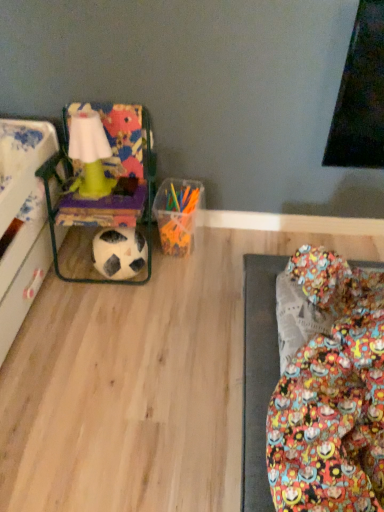
What do you see at coordinates (107, 183) in the screenshot?
I see `multicolored fabric bean bag chair at left` at bounding box center [107, 183].

The image size is (384, 512). I want to click on multicolored fabric bean bag chair at left, so click(107, 183).

Image resolution: width=384 pixels, height=512 pixels. What do you see at coordinates (119, 253) in the screenshot?
I see `black matte football at lower left` at bounding box center [119, 253].

Image resolution: width=384 pixels, height=512 pixels. Identify the location of black matte football at lower left. (119, 253).

Measure the distance between point (127, 234) and camera.

The depth of point (127, 234) is 1.53 meters.

What are the coordinates of `multicolored fabric bean bag chair at left` in the screenshot? It's located at coord(107,183).

Between multicolored fabric bean bag chair at left and black matte football at lower left, which one appears on the left side from the viewer's perspective?

multicolored fabric bean bag chair at left.

Is multicolored fabric bean bag chair at left further to the viewer compared to black matte football at lower left?

That is False.

Does point (66, 223) come in front of point (137, 240)?

Yes.

From the image's perspective, which is above, multicolored fabric bean bag chair at left or black matte football at lower left?

multicolored fabric bean bag chair at left, from the image's perspective.

From a real-world perspective, is multicolored fabric bean bag chair at left below black matte football at lower left?

No, from a real-world perspective, multicolored fabric bean bag chair at left is not below black matte football at lower left.

Based on the photo, considering the sizes of multicolored fabric bean bag chair at left and black matte football at lower left in the image, is multicolored fabric bean bag chair at left wider or thinner than black matte football at lower left?

In the image, multicolored fabric bean bag chair at left appears to be wider than black matte football at lower left.

Consider the image. Does multicolored fabric bean bag chair at left have a greater height compared to black matte football at lower left?

Yes.

Who is bigger, multicolored fabric bean bag chair at left or black matte football at lower left?

multicolored fabric bean bag chair at left is bigger.

Which is correct: multicolored fabric bean bag chair at left is inside black matte football at lower left, or outside of it?

multicolored fabric bean bag chair at left is outside black matte football at lower left.

Is multicolored fabric bean bag chair at left in contact with black matte football at lower left?

multicolored fabric bean bag chair at left is not next to black matte football at lower left, and they're not touching.

Is multicolored fabric bean bag chair at left turned away from black matte football at lower left?

No, multicolored fabric bean bag chair at left's orientation is not away from black matte football at lower left.

How different are the orientations of multicolored fabric bean bag chair at left and black matte football at lower left in degrees?

The angular difference between multicolored fabric bean bag chair at left and black matte football at lower left is 1.96 degrees.

The height and width of the screenshot is (512, 384). In the image, there is a multicolored fabric bean bag chair at left. What are the coordinates of `football below it (from a real-world perspective)` in the screenshot? It's located at (119, 253).

Does black matte football at lower left appear on the right side of multicolored fabric bean bag chair at left?

Yes, black matte football at lower left is to the right of multicolored fabric bean bag chair at left.

Relative to multicolored fabric bean bag chair at left, is black matte football at lower left in front or behind?

Visually, black matte football at lower left is located behind multicolored fabric bean bag chair at left.

Is point (105, 255) closer to camera compared to point (80, 115)?

No, (105, 255) is behind (80, 115).

From the image's perspective, does black matte football at lower left appear lower than multicolored fabric bean bag chair at left?

Indeed, from the image's perspective, black matte football at lower left is shown beneath multicolored fabric bean bag chair at left.

From a real-world perspective, which object rests below the other?

black matte football at lower left.

Considering the sizes of objects black matte football at lower left and multicolored fabric bean bag chair at left in the image provided, who is wider, black matte football at lower left or multicolored fabric bean bag chair at left?

With larger width is multicolored fabric bean bag chair at left.

Does black matte football at lower left have a lesser height compared to multicolored fabric bean bag chair at left?

Indeed, black matte football at lower left has a lesser height compared to multicolored fabric bean bag chair at left.

In terms of size, does black matte football at lower left appear bigger or smaller than multicolored fabric bean bag chair at left?

Clearly, black matte football at lower left is smaller in size than multicolored fabric bean bag chair at left.

Is black matte football at lower left spatially inside multicolored fabric bean bag chair at left, or outside of it?

black matte football at lower left is located inside multicolored fabric bean bag chair at left.

Is black matte football at lower left with multicolored fabric bean bag chair at left?

black matte football at lower left and multicolored fabric bean bag chair at left are clearly separated.

Does black matte football at lower left turn towards multicolored fabric bean bag chair at left?

Yes, black matte football at lower left is aimed at multicolored fabric bean bag chair at left.

What's the angular difference between black matte football at lower left and multicolored fabric bean bag chair at left's facing directions?

1.96 degrees.

Where is `football below the multicolored fabric bean bag chair at left (from the image's perspective)`? The height and width of the screenshot is (512, 384). football below the multicolored fabric bean bag chair at left (from the image's perspective) is located at coordinates (119, 253).

The height and width of the screenshot is (512, 384). I want to click on bean bag chair in front of the black matte football at lower left, so click(x=107, y=183).

At what (x,y) coordinates should I click in order to perform the action: click on football below the multicolored fabric bean bag chair at left (from a real-world perspective). Please return your answer as a coordinate pair (x, y). Image resolution: width=384 pixels, height=512 pixels. Looking at the image, I should click on (119, 253).